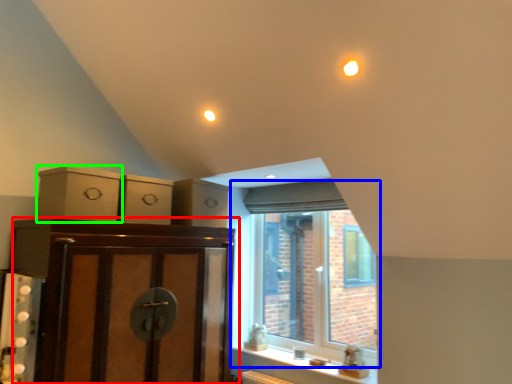
Question: Which object is positioned farthest from cabinetry (highlighted by a red box)? Select from window (highlighted by a blue box) and cabinetry (highlighted by a green box).

Choices:
 (A) window
 (B) cabinetry

Answer: (A)